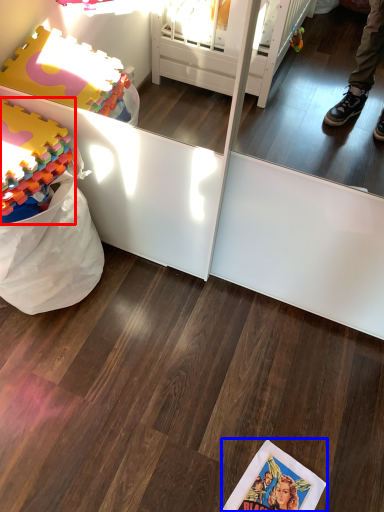
Question: Which of the following is the farthest to the observer, toy (highlighted by a red box) or comic book (highlighted by a blue box)?

Choices:
 (A) toy
 (B) comic book

Answer: (B)